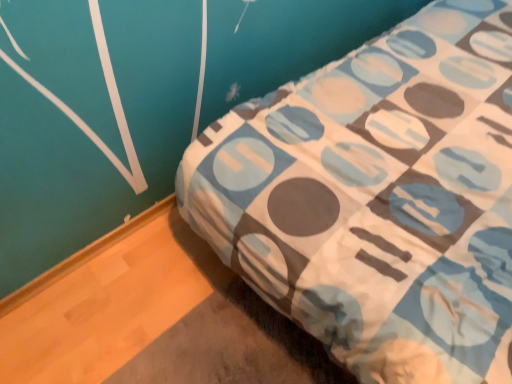
The image size is (512, 384). Describe the element at coordinates (377, 198) in the screenshot. I see `patterned fabric bed at upper right` at that location.

The height and width of the screenshot is (384, 512). Identify the location of patterned fabric bed at upper right. (377, 198).

This screenshot has height=384, width=512. In order to click on patterned fabric bed at upper right in this screenshot , I will do `click(377, 198)`.